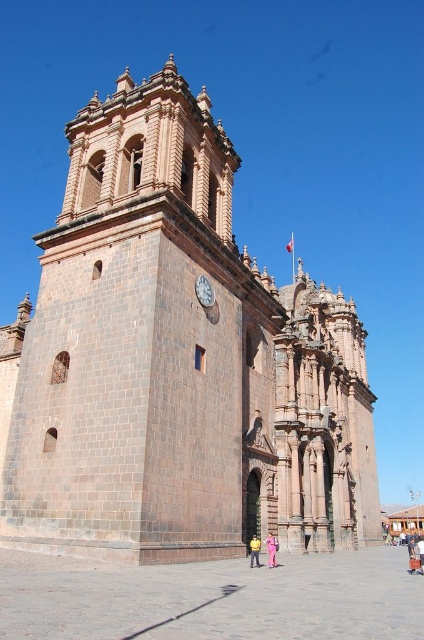
You are standing in front of the historic stone building and notice the matte stone clock at center and the yellow fabric person at lower center. Which object is taller?

The yellow fabric person at lower center is taller than the matte stone clock at center.

You are standing at the entrance of the historic stone building and see the matte stone clock at center and the pink fabric person at center. You want to greet the person without leaving the building. Can you reach them by walking straight ahead from the entrance?

The matte stone clock at center and pink fabric person at center are 20.84 meters apart. Since you are inside the building, the distance between you and the person depends on the building layout. However, the straight path might be obstructed by walls or other structures. Without knowing the exact path, it is uncertain if you can reach them by walking straight ahead.